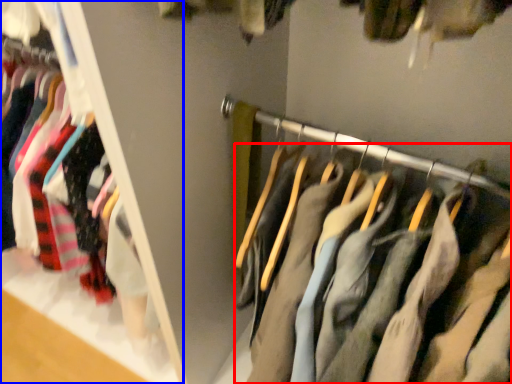
Question: Which point is closer to the camera, trousers (highlighted by a red box) or closet (highlighted by a blue box)?

Choices:
 (A) trousers
 (B) closet

Answer: (A)